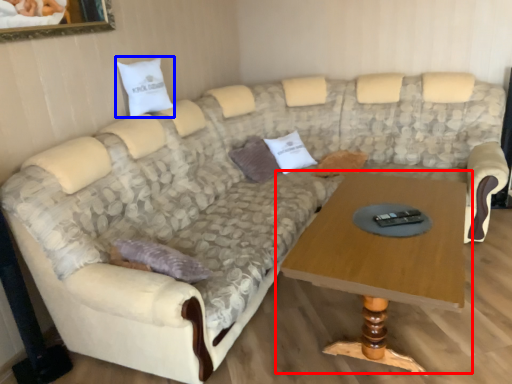
Question: Which of the following is the closest to the observer, coffee table (highlighted by a red box) or pillow (highlighted by a blue box)?

Choices:
 (A) coffee table
 (B) pillow

Answer: (A)